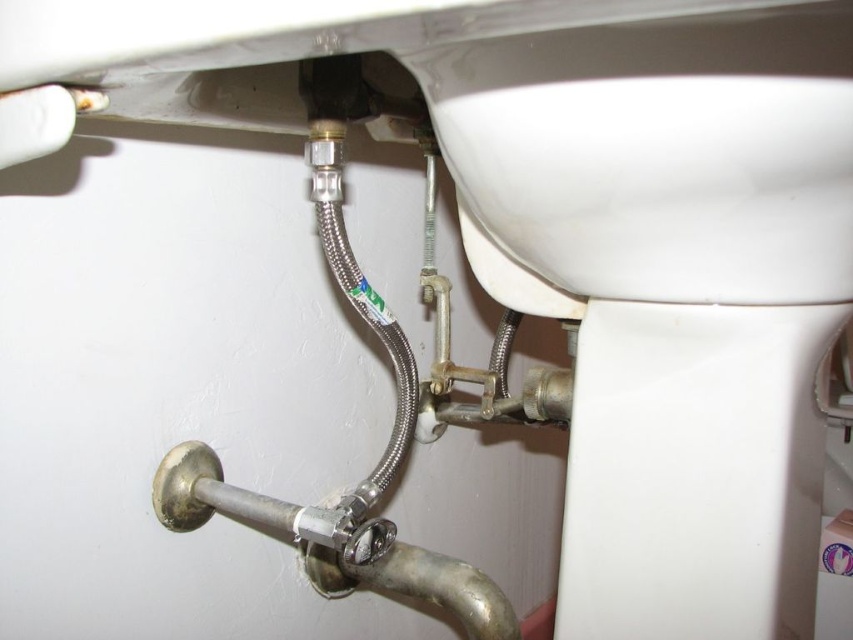
Based on the photo, is white glossy sink at upper center above silver metallic pipe at center?

Yes.

Can you confirm if white glossy sink at upper center is taller than silver metallic pipe at center?

In fact, white glossy sink at upper center may be shorter than silver metallic pipe at center.

Where is `white glossy sink at upper center`? white glossy sink at upper center is located at coordinates (660, 154).

At what (x,y) coordinates should I click in order to perform the action: click on white glossy sink at upper center. Please return your answer as a coordinate pair (x, y). Looking at the image, I should click on (660, 154).